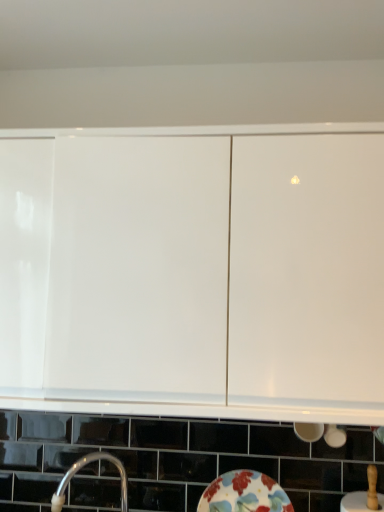
Question: Can you confirm if white glossy cabinet at upper center is taller than silver metallic tap at lower left?

Choices:
 (A) yes
 (B) no

Answer: (A)

Question: Would you say white glossy cabinet at upper center is outside silver metallic tap at lower left?

Choices:
 (A) yes
 (B) no

Answer: (A)

Question: Considering the relative positions of white glossy cabinet at upper center and silver metallic tap at lower left in the image provided, is white glossy cabinet at upper center to the right of silver metallic tap at lower left from the viewer's perspective?

Choices:
 (A) no
 (B) yes

Answer: (B)

Question: Is silver metallic tap at lower left a part of white glossy cabinet at upper center?

Choices:
 (A) no
 (B) yes

Answer: (A)

Question: Is the position of white glossy cabinet at upper center more distant than that of silver metallic tap at lower left?

Choices:
 (A) no
 (B) yes

Answer: (A)

Question: Is white glossy cabinet at upper center in front of silver metallic tap at lower left?

Choices:
 (A) no
 (B) yes

Answer: (B)

Question: From the image's perspective, is silver metallic tap at lower left on floral ceramic plate at lower center?

Choices:
 (A) yes
 (B) no

Answer: (A)

Question: From a real-world perspective, is silver metallic tap at lower left under floral ceramic plate at lower center?

Choices:
 (A) yes
 (B) no

Answer: (B)

Question: From a real-world perspective, is silver metallic tap at lower left located higher than floral ceramic plate at lower center?

Choices:
 (A) yes
 (B) no

Answer: (A)

Question: From the image's perspective, is silver metallic tap at lower left beneath floral ceramic plate at lower center?

Choices:
 (A) yes
 (B) no

Answer: (B)

Question: Is silver metallic tap at lower left in front of floral ceramic plate at lower center?

Choices:
 (A) yes
 (B) no

Answer: (A)

Question: Would you consider silver metallic tap at lower left to be distant from floral ceramic plate at lower center?

Choices:
 (A) no
 (B) yes

Answer: (A)

Question: Can you confirm if white glossy cabinet at upper center is smaller than floral ceramic plate at lower center?

Choices:
 (A) no
 (B) yes

Answer: (A)